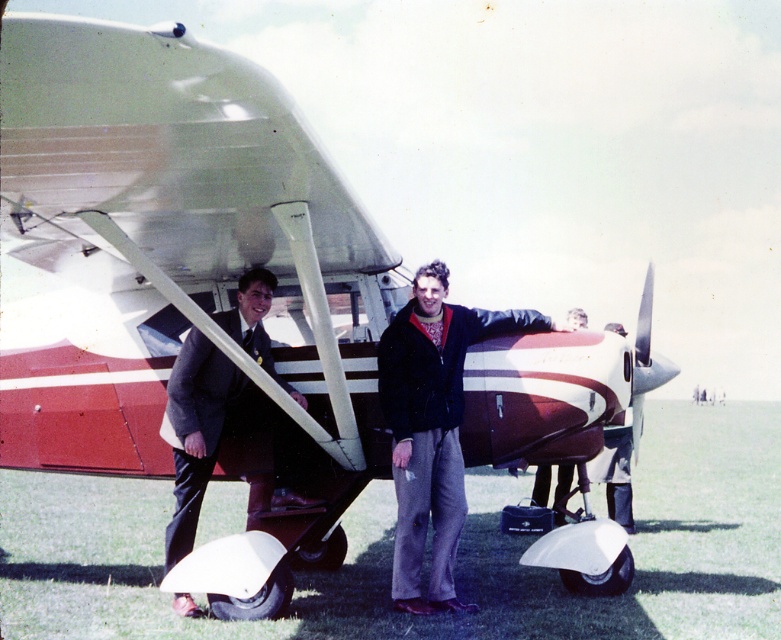
You are standing at the origin point of the coordinate system. You want to walk to the dark blue leather jacket at center. Which direction should you go?

The dark blue leather jacket at center is located at coordinate point 0.669 on the x axis and 0.554 on the y axis. Since the origin is at the bottom left corner of the image, you should move to the right and slightly upwards to reach the dark blue leather jacket at center.